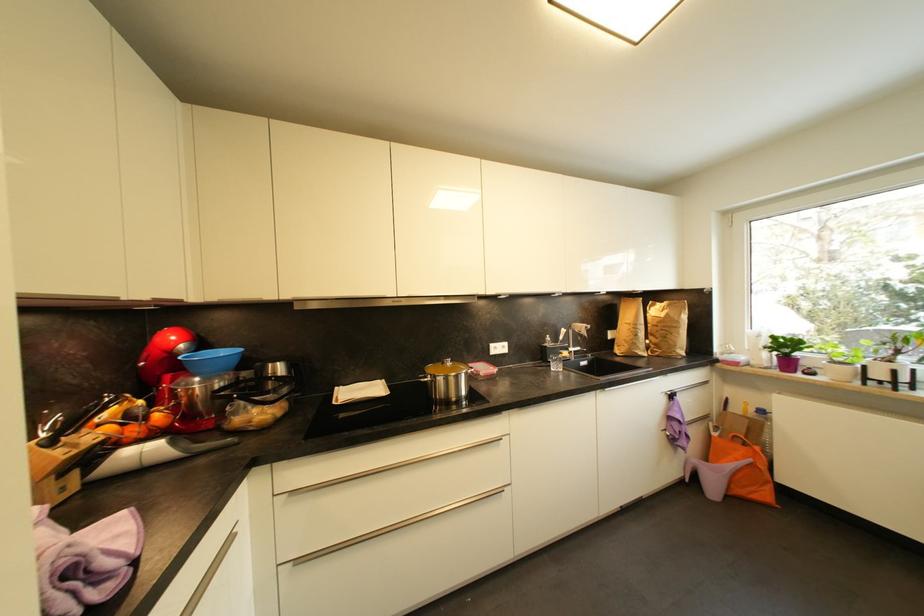
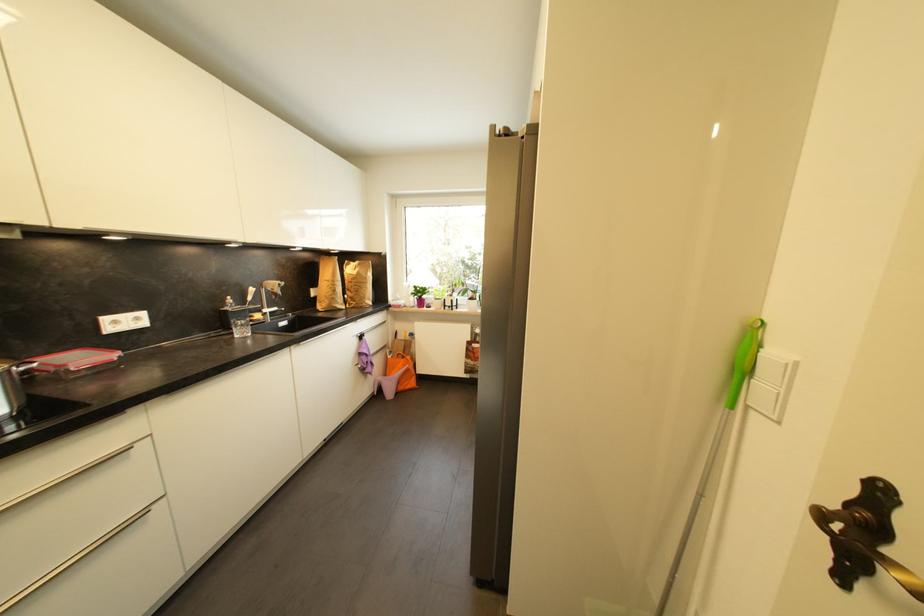
The point at (640, 337) is marked in the first image. Where is the corresponding point in the second image?

(339, 293)